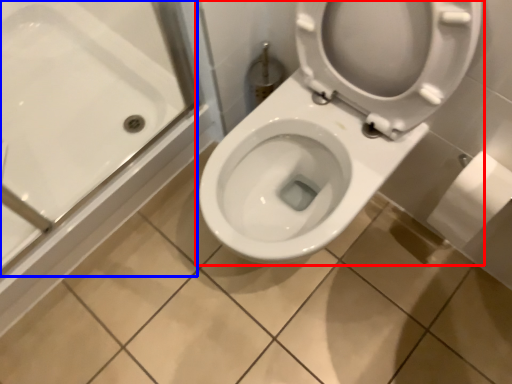
Question: Which of the following is the farthest to the observer, toilet (highlighted by a red box) or bath (highlighted by a blue box)?

Choices:
 (A) toilet
 (B) bath

Answer: (B)